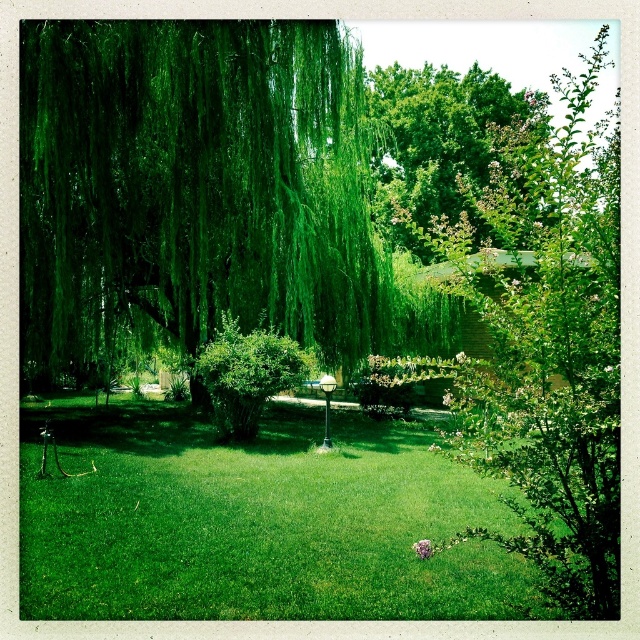
Question: Which of the following is the farthest from the observer?

Choices:
 (A) (564, 259)
 (B) (262, 353)

Answer: (B)

Question: Is green leafy willow at upper left closer to the viewer compared to green leafy tree at upper center?

Choices:
 (A) yes
 (B) no

Answer: (A)

Question: Which is farther from the green leafy tree at upper center?

Choices:
 (A) green grass at center
 (B) green leafy bush at center

Answer: (A)

Question: Considering the relative positions of green leafy tree at upper center and green leafy bush at center in the image provided, where is green leafy tree at upper center located with respect to green leafy bush at center?

Choices:
 (A) left
 (B) right

Answer: (B)

Question: Which of the following is the closest to the observer?

Choices:
 (A) green leafy tree at upper center
 (B) green leafy willow at upper left
 (C) green leafy bush at center
 (D) green leafy tree at center

Answer: (D)

Question: Does green leafy willow at upper left appear on the left side of green grass at center?

Choices:
 (A) yes
 (B) no

Answer: (A)